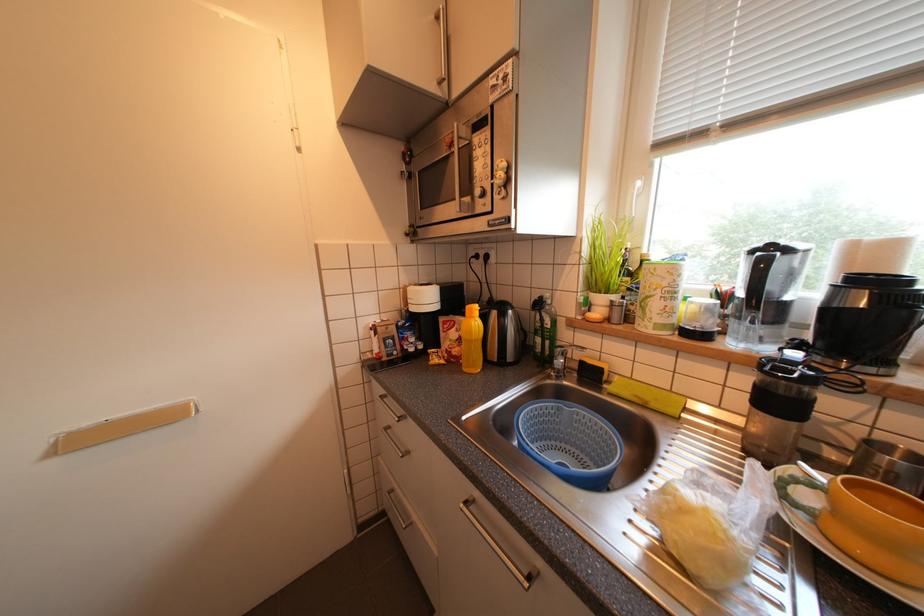
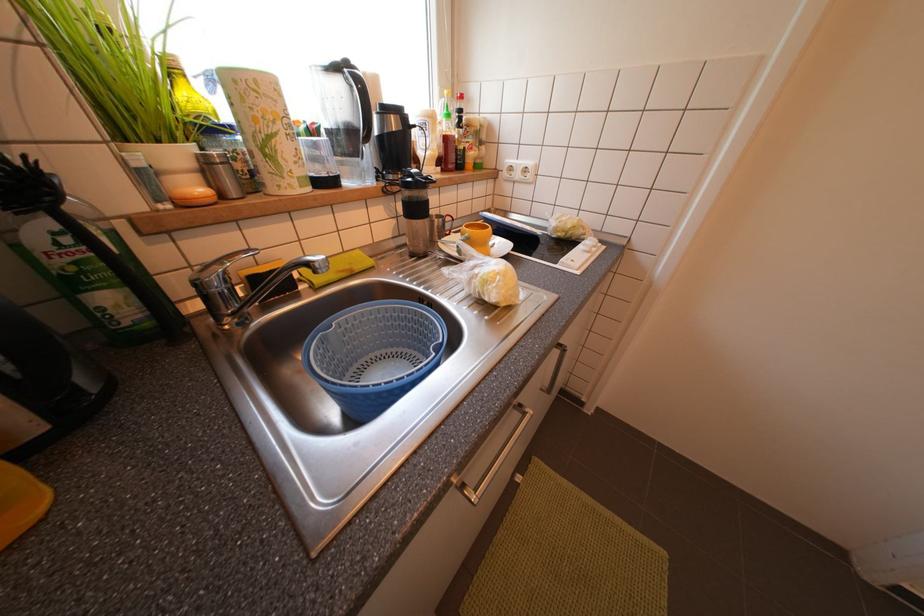
How did the camera likely rotate?

The rotation direction of the camera is right-down.